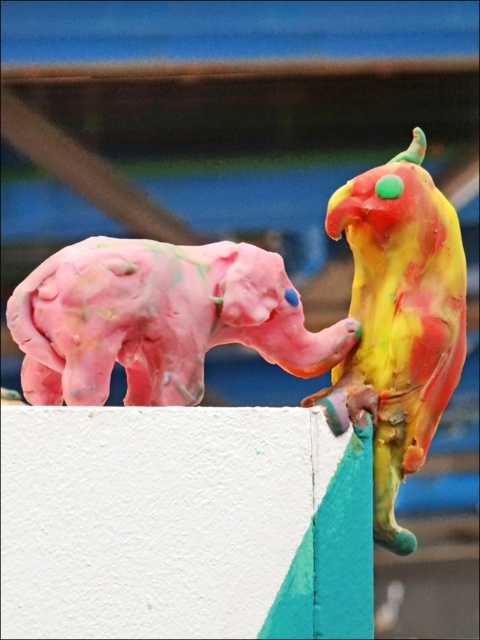
Does matte clay elephant at upper left appear on the right side of multicolored clay parrot at upper right?

No, matte clay elephant at upper left is not to the right of multicolored clay parrot at upper right.

Is point (9, 305) closer to camera compared to point (367, 268)?

Yes, it is in front of point (367, 268).

In order to click on matte clay elephant at upper left in this screenshot , I will do `click(276, 321)`.

Is pink clay elephant at upper left behind multicolored clay parrot at upper right?

That is False.

Is pink clay elephant at upper left taller than multicolored clay parrot at upper right?

No, pink clay elephant at upper left is not taller than multicolored clay parrot at upper right.

Which is behind, point (118, 268) or point (398, 221)?

Point (398, 221)

The image size is (480, 640). I want to click on pink clay elephant at upper left, so click(157, 320).

Who is shorter, matte clay elephant at upper left or pink clay elephant at upper left?

pink clay elephant at upper left

Can you confirm if matte clay elephant at upper left is smaller than pink clay elephant at upper left?

Actually, matte clay elephant at upper left might be larger than pink clay elephant at upper left.

You are a GUI agent. You are given a task and a screenshot of the screen. Output one action in this format:
    pyautogui.click(x=<x>, y=<y>)
    Task: Click on the matte clay elephant at upper left
    
    Given the screenshot: What is the action you would take?
    pyautogui.click(x=276, y=321)

This screenshot has width=480, height=640. In order to click on matte clay elephant at upper left in this screenshot , I will do `click(276, 321)`.